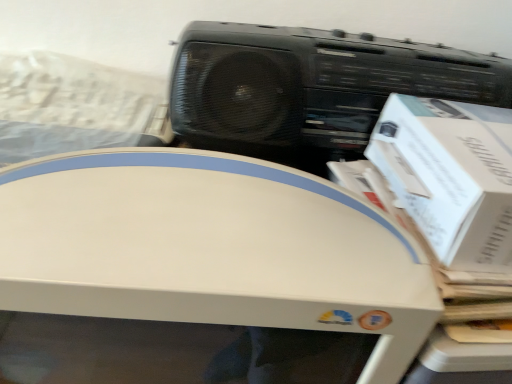
Question: Does black plastic cassette at upper right have a smaller size compared to white plastic printer at center?

Choices:
 (A) no
 (B) yes

Answer: (B)

Question: From the image's perspective, is black plastic cassette at upper right located beneath white plastic printer at center?

Choices:
 (A) yes
 (B) no

Answer: (B)

Question: Is black plastic cassette at upper right bigger than white plastic printer at center?

Choices:
 (A) yes
 (B) no

Answer: (B)

Question: Considering the relative positions of black plastic cassette at upper right and white plastic printer at center in the image provided, is black plastic cassette at upper right to the right of white plastic printer at center from the viewer's perspective?

Choices:
 (A) no
 (B) yes

Answer: (B)

Question: Is black plastic cassette at upper right positioned in front of white plastic printer at center?

Choices:
 (A) no
 (B) yes

Answer: (A)

Question: Looking at their shapes, would you say white cardboard box at right is wider or thinner than white plastic printer at center?

Choices:
 (A) wide
 (B) thin

Answer: (B)

Question: Is white cardboard box at right situated inside white plastic printer at center or outside?

Choices:
 (A) outside
 (B) inside

Answer: (A)

Question: Would you say white cardboard box at right is to the left or to the right of white plastic printer at center in the picture?

Choices:
 (A) left
 (B) right

Answer: (B)

Question: In terms of size, does white cardboard box at right appear bigger or smaller than white plastic printer at center?

Choices:
 (A) big
 (B) small

Answer: (B)

Question: From a real-world perspective, relative to white cardboard box at right, is white plastic printer at center vertically above or below?

Choices:
 (A) above
 (B) below

Answer: (B)

Question: In terms of size, does white plastic printer at center appear bigger or smaller than white cardboard box at right?

Choices:
 (A) big
 (B) small

Answer: (A)

Question: Do you think white plastic printer at center is within white cardboard box at right, or outside of it?

Choices:
 (A) outside
 (B) inside

Answer: (A)

Question: From the image's perspective, is white plastic printer at center positioned above or below white cardboard box at right?

Choices:
 (A) below
 (B) above

Answer: (A)

Question: Is white plastic printer at center situated inside black plastic cassette at upper right or outside?

Choices:
 (A) inside
 (B) outside

Answer: (B)

Question: In terms of size, does white plastic printer at center appear bigger or smaller than black plastic cassette at upper right?

Choices:
 (A) big
 (B) small

Answer: (A)